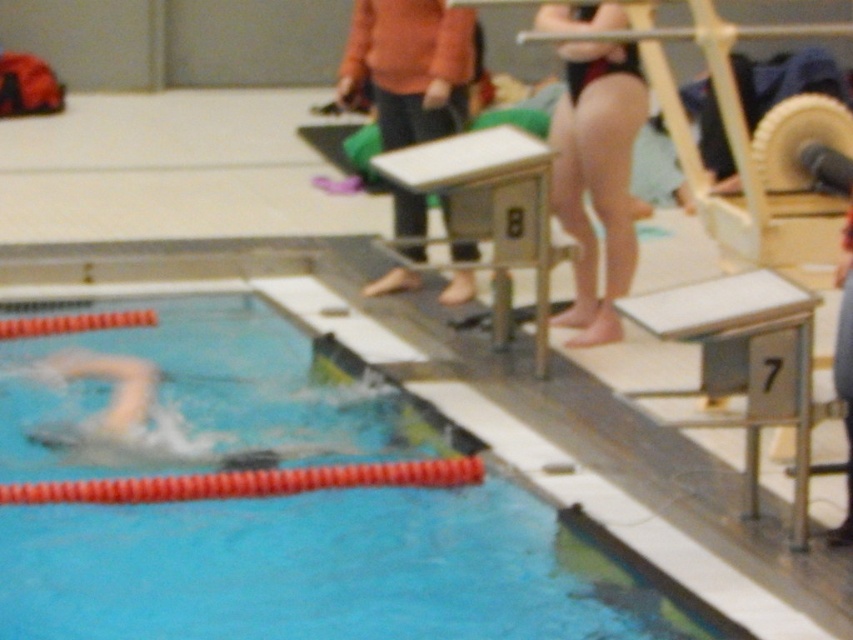
Question: Can you confirm if blue rubber pool lane at lower left is positioned to the right of black swimsuit at upper right?

Choices:
 (A) yes
 (B) no

Answer: (B)

Question: Among these points, which one is nearest to the camera?

Choices:
 (A) (42, 477)
 (B) (610, 262)

Answer: (A)

Question: Is blue rubber pool lane at lower left below black swimsuit at upper right?

Choices:
 (A) no
 (B) yes

Answer: (B)

Question: Does blue rubber pool lane at lower left have a lesser width compared to black swimsuit at upper right?

Choices:
 (A) no
 (B) yes

Answer: (A)